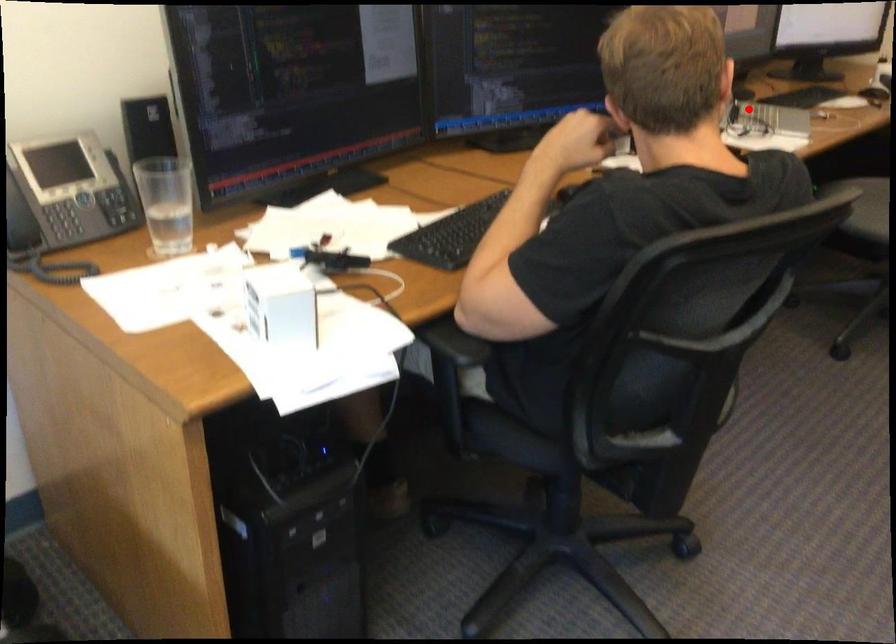
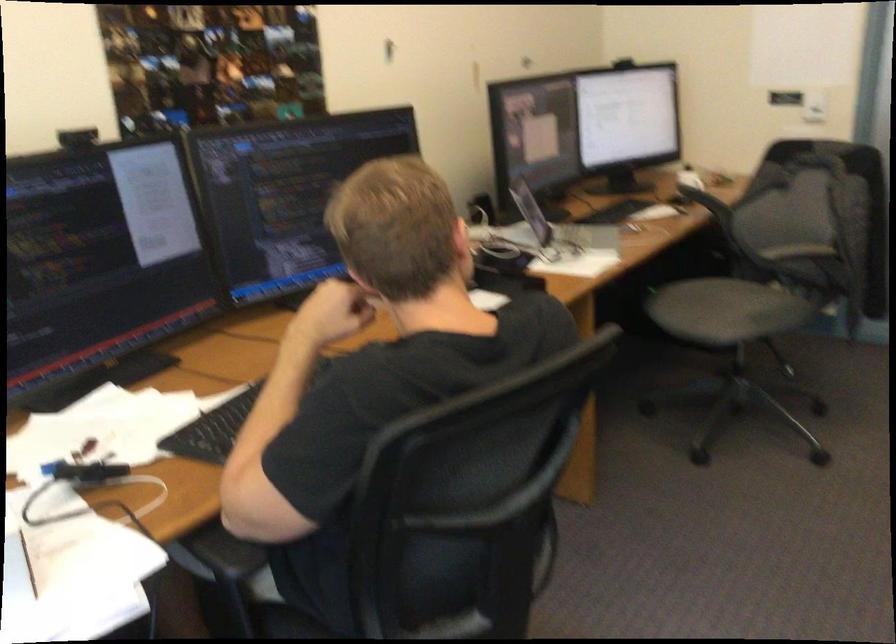
In the second image, find the point that corresponds to the highlighted location in the first image.

(561, 230)